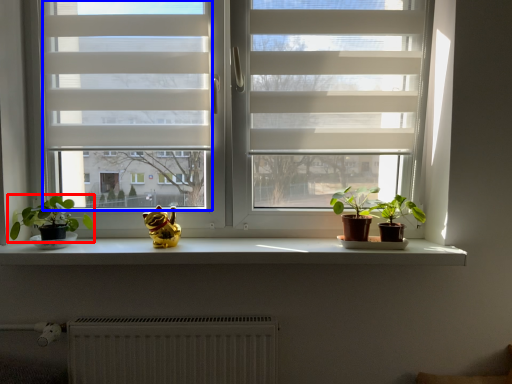
Question: Which object appears farthest to the camera in this image, houseplant (highlighted by a red box) or window screen (highlighted by a blue box)?

Choices:
 (A) houseplant
 (B) window screen

Answer: (B)